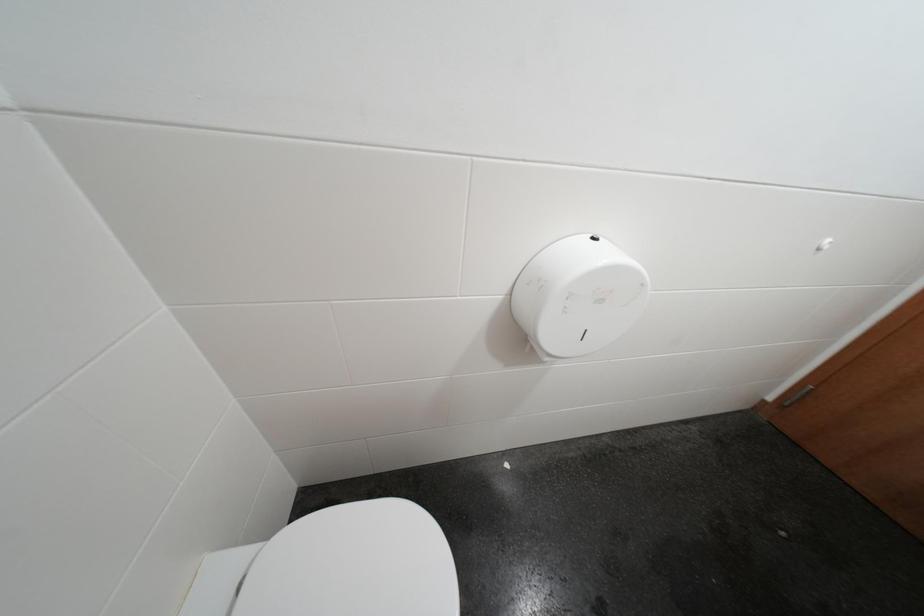
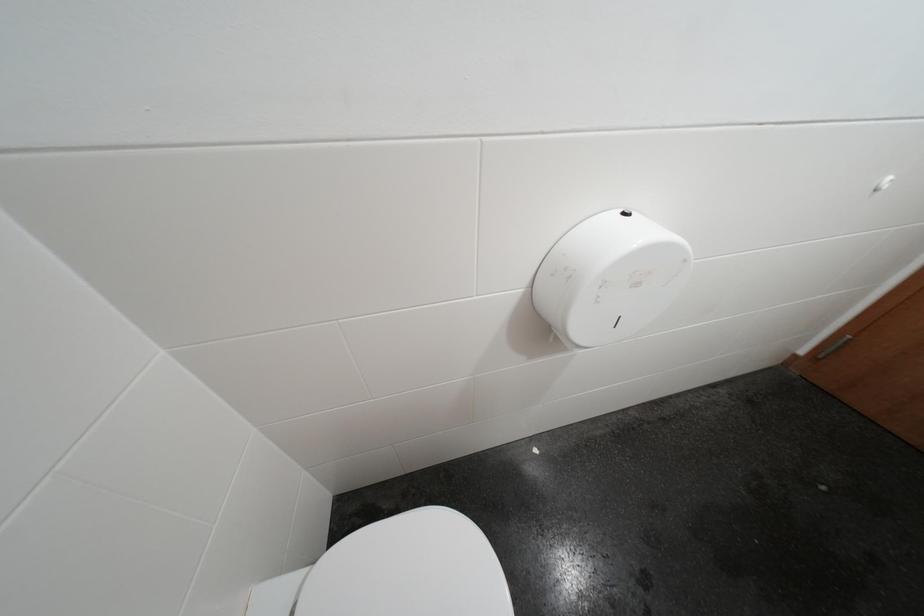
Which direction would the cameraman need to move to produce the second image?

The movement direction of the cameraman is left, forward.